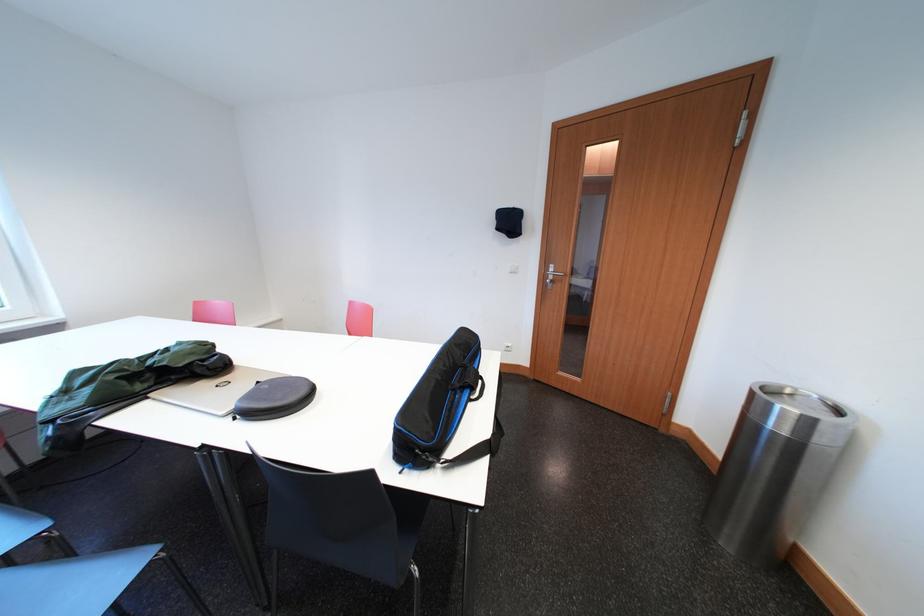
Find where to lift the black bag handle. Please return your answer as a coordinate pair (x, y).

(478, 391)